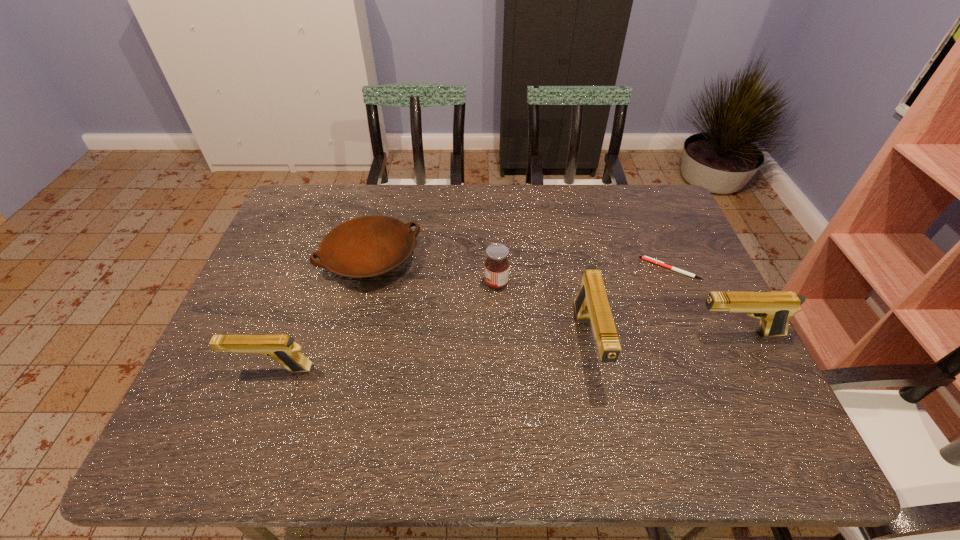
Identify the location of free space that satisfies the following two spatial constraints: 1. at the barrel of the second tallest object; 2. at the barrel of the fourth object from left to right. (742, 345).

You are a GUI agent. You are given a task and a screenshot of the screen. Output one action in this format:
    pyautogui.click(x=<x>, y=<y>)
    Task: Click on the free region that satisfies the following two spatial constraints: 1. on the clicker of the pen; 2. at the barrel of the second pistol from right to left
    
    Given the screenshot: What is the action you would take?
    pyautogui.click(x=703, y=345)

Find the location of `free spot that satisfies the following two spatial constraints: 1. at the barrel of the second tallest pistol; 2. at the barrel of the fourth object from left to right`. free spot that satisfies the following two spatial constraints: 1. at the barrel of the second tallest pistol; 2. at the barrel of the fourth object from left to right is located at coordinates (742, 345).